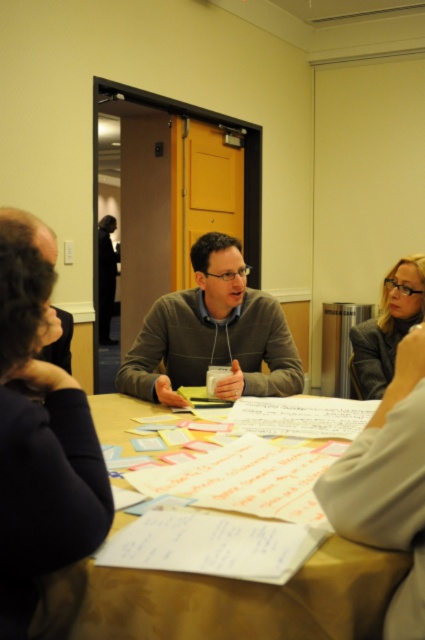
Question: Is matte gray blazer at upper right closer to the viewer compared to dark brown hair at upper left?

Choices:
 (A) no
 (B) yes

Answer: (A)

Question: Which point is closer to the camera?

Choices:
 (A) (195, 316)
 (B) (56, 256)
 (C) (161, 636)

Answer: (C)

Question: Which point appears farthest from the camera in this image?

Choices:
 (A) (357, 336)
 (B) (172, 381)

Answer: (A)

Question: Can you confirm if brown paper table at center is positioned below matte gray blazer at upper right?

Choices:
 (A) yes
 (B) no

Answer: (A)

Question: Which point is farther to the camera?

Choices:
 (A) (2, 211)
 (B) (268, 356)
 (C) (193, 596)
 (D) (421, 275)

Answer: (D)

Question: Does brown paper table at center lie in front of matte gray blazer at upper right?

Choices:
 (A) yes
 (B) no

Answer: (A)